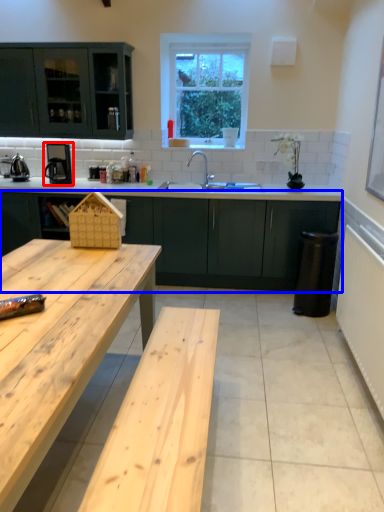
Question: Which object appears farthest to the camera in this image, coffee machine (highlighted by a red box) or cabinetry (highlighted by a blue box)?

Choices:
 (A) coffee machine
 (B) cabinetry

Answer: (A)